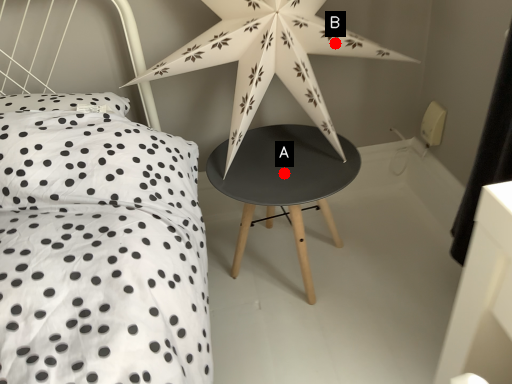
Question: Two points are circled on the image, labeled by A and B beside each circle. Which point is closer to the camera?

Choices:
 (A) A is closer
 (B) B is closer

Answer: (B)